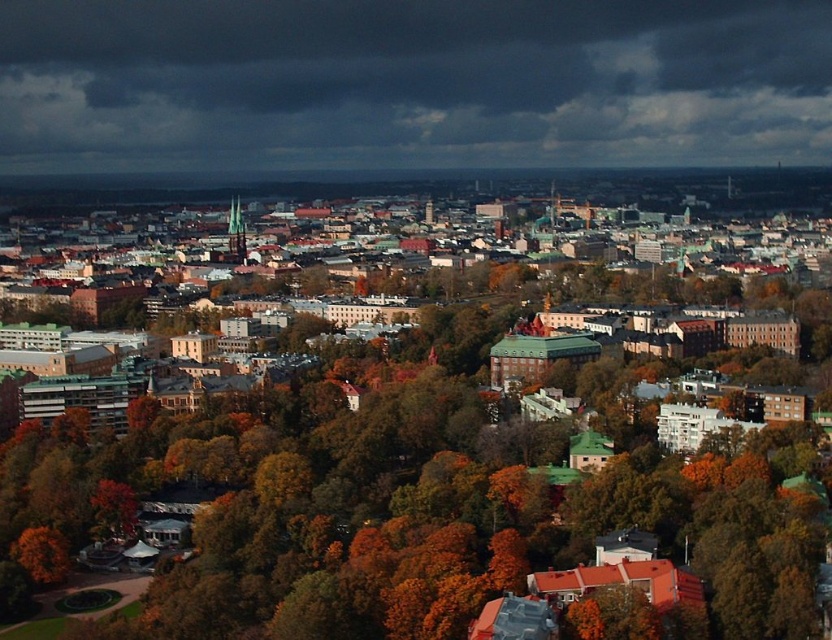
Can you confirm if brown/wooden trees at center is shorter than orange leafy tree at lower left?

No, brown/wooden trees at center is not shorter than orange leafy tree at lower left.

Is brown/wooden trees at center positioned in front of orange leafy tree at lower left?

Yes, it is.

Identify the location of brown/wooden trees at center. This screenshot has width=832, height=640. (414, 490).

This screenshot has width=832, height=640. Find the location of `brown/wooden trees at center`. brown/wooden trees at center is located at coordinates (414, 490).

Is dark gray cloud at upper center positioned in front of orange leafy tree at lower left?

No, it is behind orange leafy tree at lower left.

Describe the element at coordinates (410, 83) in the screenshot. I see `dark gray cloud at upper center` at that location.

This screenshot has width=832, height=640. What do you see at coordinates (410, 83) in the screenshot?
I see `dark gray cloud at upper center` at bounding box center [410, 83].

The image size is (832, 640). In order to click on dark gray cloud at upper center in this screenshot , I will do `click(410, 83)`.

This screenshot has height=640, width=832. Describe the element at coordinates (414, 490) in the screenshot. I see `brown/wooden trees at center` at that location.

Between brown/wooden trees at center and dark gray cloud at upper center, which one has less height?

dark gray cloud at upper center is shorter.

Between point (437, 339) and point (602, 128), which one is positioned in front?

Point (437, 339)

Locate an element on the screen. This screenshot has width=832, height=640. brown/wooden trees at center is located at coordinates (414, 490).